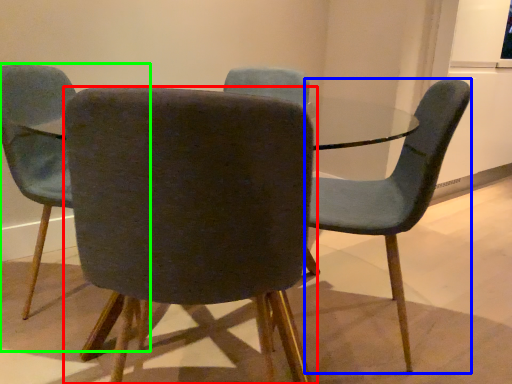
Question: Which is farther away from chair (highlighted by a red box)? chair (highlighted by a blue box) or chair (highlighted by a green box)?

Choices:
 (A) chair
 (B) chair

Answer: (B)